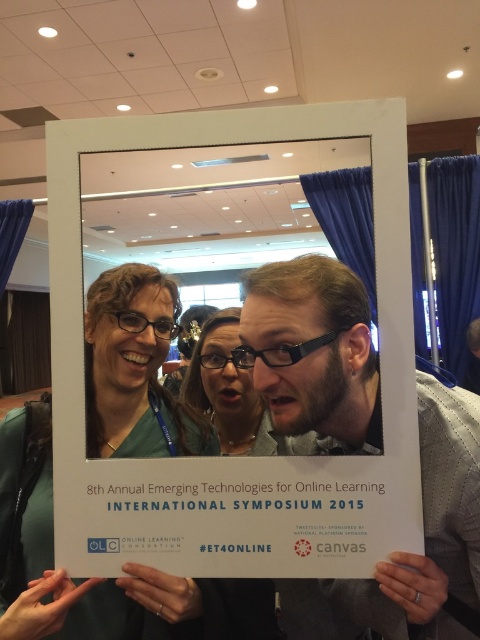
From the picture: You are a photographer at the 8th Annual Emerging Technologies for Online Learning International Symposium 2015. You need to ensure that the white paper at center and the matte black glasses at center are both visible in the photo. Based on their sizes, which object will appear larger in the final photo?

The white paper at center is taller than matte black glasses at center, so the white paper at center will appear larger in the photo.

In the photo of the conference group, there is a white paper at center and matte black glasses at center. Which object is located to the right of the other?

The white paper at center is positioned on the right side of matte black glasses at center.